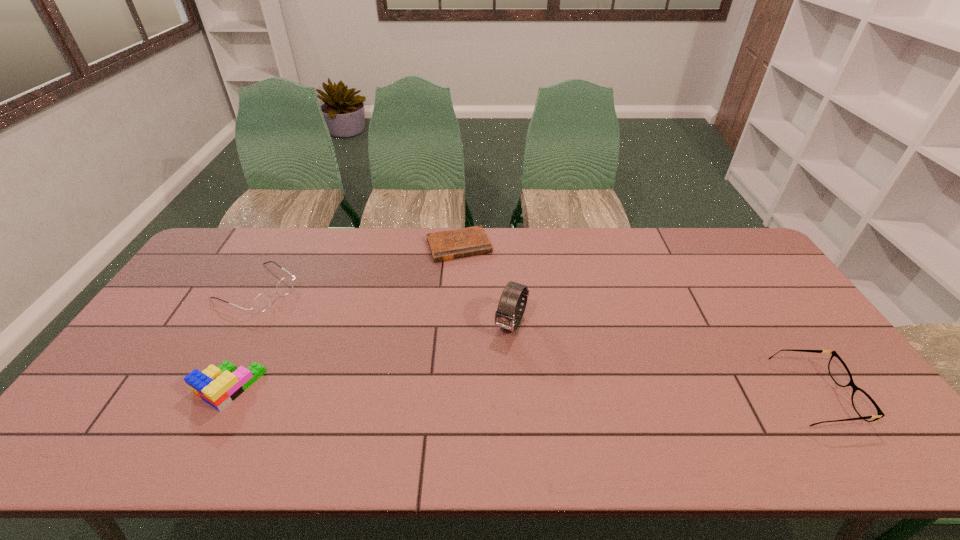
Locate an element on the screen. The width and height of the screenshot is (960, 540). vacant spot on the desktop that is between the Lego and the rightmost object and is positioned through the lenses of the farther spectacles is located at coordinates (438, 390).

Where is `free space on the desktop that is between the Lego and the nearer spectacles and is positioned on the face of the watch`? free space on the desktop that is between the Lego and the nearer spectacles and is positioned on the face of the watch is located at coordinates (475, 391).

Identify the location of free spot on the desktop that is between the Lego and the rightmost object and is positioned on the spine side of the farthest object. (516, 392).